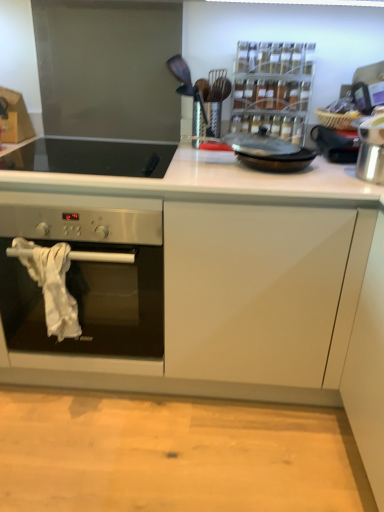
Question: Is black glass cooktop at upper left shorter than silver metallic pot at right, marked as the 1th appliance in a right-to-left arrangement?

Choices:
 (A) no
 (B) yes

Answer: (B)

Question: From the image's perspective, is black glass cooktop at upper left under silver metallic pot at right, positioned as the 3th appliance in left-to-right order?

Choices:
 (A) no
 (B) yes

Answer: (B)

Question: Can you confirm if black glass cooktop at upper left is positioned to the left of silver metallic pot at right, marked as the 1th appliance in a right-to-left arrangement?

Choices:
 (A) no
 (B) yes

Answer: (B)

Question: Is black glass cooktop at upper left turned away from silver metallic pot at right, marked as the 1th appliance in a right-to-left arrangement?

Choices:
 (A) no
 (B) yes

Answer: (A)

Question: Is black glass cooktop at upper left touching silver metallic pot at right, marked as the 1th appliance in a right-to-left arrangement?

Choices:
 (A) yes
 (B) no

Answer: (B)

Question: Does black glass cooktop at upper left have a lesser width compared to silver metallic pot at right, marked as the 1th appliance in a right-to-left arrangement?

Choices:
 (A) yes
 (B) no

Answer: (B)

Question: Is black glass frying pan at center closer to camera compared to silver metallic pot at right, marked as the 1th appliance in a right-to-left arrangement?

Choices:
 (A) yes
 (B) no

Answer: (A)

Question: From the image's perspective, does black glass frying pan at center appear lower than silver metallic pot at right, marked as the 1th appliance in a right-to-left arrangement?

Choices:
 (A) no
 (B) yes

Answer: (B)

Question: Is the depth of black glass frying pan at center greater than that of silver metallic pot at right, positioned as the 3th appliance in left-to-right order?

Choices:
 (A) yes
 (B) no

Answer: (B)

Question: Considering the relative sizes of black glass frying pan at center and silver metallic pot at right, marked as the 1th appliance in a right-to-left arrangement, in the image provided, is black glass frying pan at center thinner than silver metallic pot at right, marked as the 1th appliance in a right-to-left arrangement,?

Choices:
 (A) yes
 (B) no

Answer: (A)

Question: From a real-world perspective, is black glass frying pan at center located higher than silver metallic pot at right, positioned as the 3th appliance in left-to-right order?

Choices:
 (A) yes
 (B) no

Answer: (B)

Question: Considering the relative positions of black glass frying pan at center and silver metallic pot at right, marked as the 1th appliance in a right-to-left arrangement, in the image provided, is black glass frying pan at center to the right of silver metallic pot at right, marked as the 1th appliance in a right-to-left arrangement, from the viewer's perspective?

Choices:
 (A) no
 (B) yes

Answer: (A)

Question: Does silver metallic pot at right, marked as the 1th appliance in a right-to-left arrangement, come behind black glass cooktop at upper left?

Choices:
 (A) yes
 (B) no

Answer: (A)